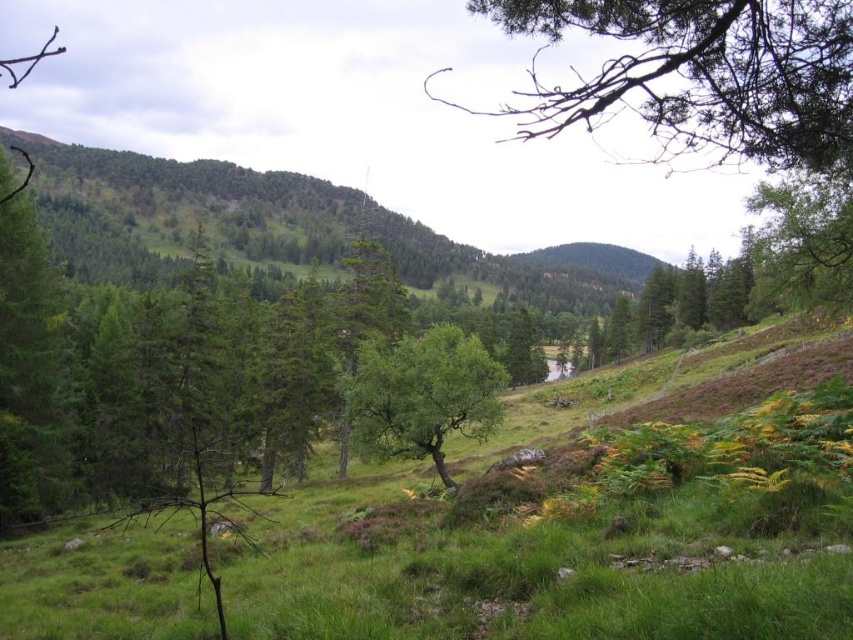
You are standing in the forest looking at the landscape. There is a point marked at coordinates (698,76). What object in the scene does this point correspond to?

The point corresponds to the green leafy tree at upper right.

Based on the photo, you are standing at the center of the image and want to take a photo of the green leafy tree at upper right. In which direction should you point your camera to capture it?

The green leafy tree at upper right is located at point coordinates indicating it is in the upper right direction from your current position at the center. You should point your camera towards the upper right to capture it.

You are an ecologist studying tree growth patterns in this forest. You notice two specific trees in your field of view. The first is the green leafy tree at upper right, and the second is the green leafy tree at center. Based on their visual characteristics, which tree would you estimate to have a wider trunk circumference?

The green leafy tree at upper right has a larger width than the green leafy tree at center, so the green leafy tree at upper right likely has a wider trunk circumference.